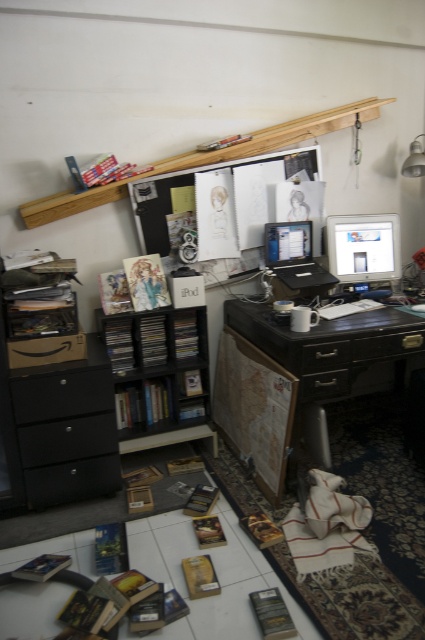
Who is lower down, black matte file cabinet at lower left or black matte drawer at center?

A: Positioned lower is black matte file cabinet at lower left.

What are the coordinates of `black matte file cabinet at lower left` in the screenshot? It's located at (65, 429).

Who is more distant from viewer, (x=22, y=500) or (x=314, y=388)?

The point (x=314, y=388) is behind.

This screenshot has height=640, width=425. In order to click on black matte file cabinet at lower left in this screenshot , I will do `click(65, 429)`.

Does black matte drawer at center have a lesser width compared to black wood drawer at center?

In fact, black matte drawer at center might be wider than black wood drawer at center.

Can you confirm if black matte drawer at center is wider than black wood drawer at center?

Yes, black matte drawer at center is wider than black wood drawer at center.

I want to click on black matte drawer at center, so click(x=323, y=385).

Does black plastic laptop at center appear over black wood drawer at center?

Yes, black plastic laptop at center is above black wood drawer at center.

Does black plastic laptop at center have a lesser height compared to black wood drawer at center?

Incorrect, black plastic laptop at center's height does not fall short of black wood drawer at center's.

The height and width of the screenshot is (640, 425). Find the location of `black plastic laptop at center`. black plastic laptop at center is located at coordinates (294, 257).